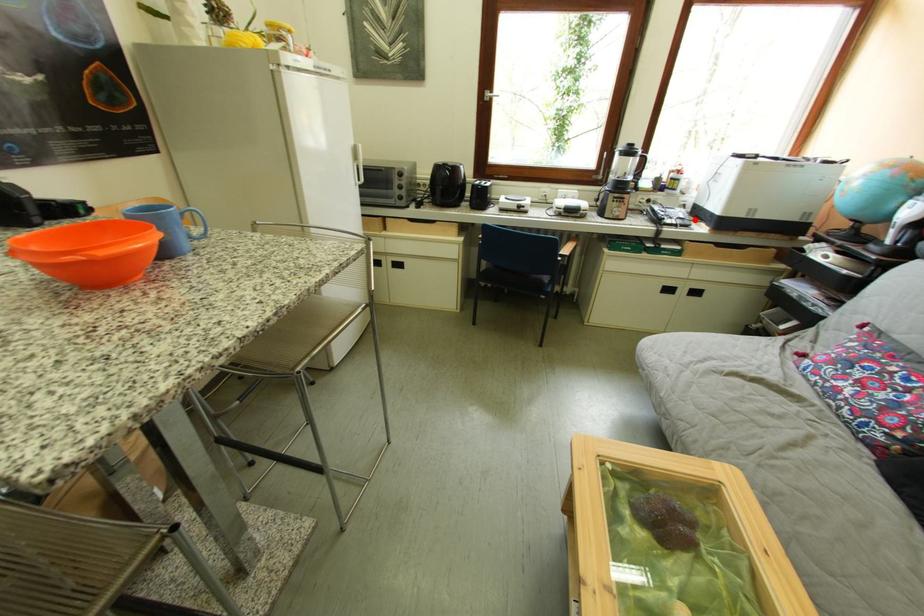
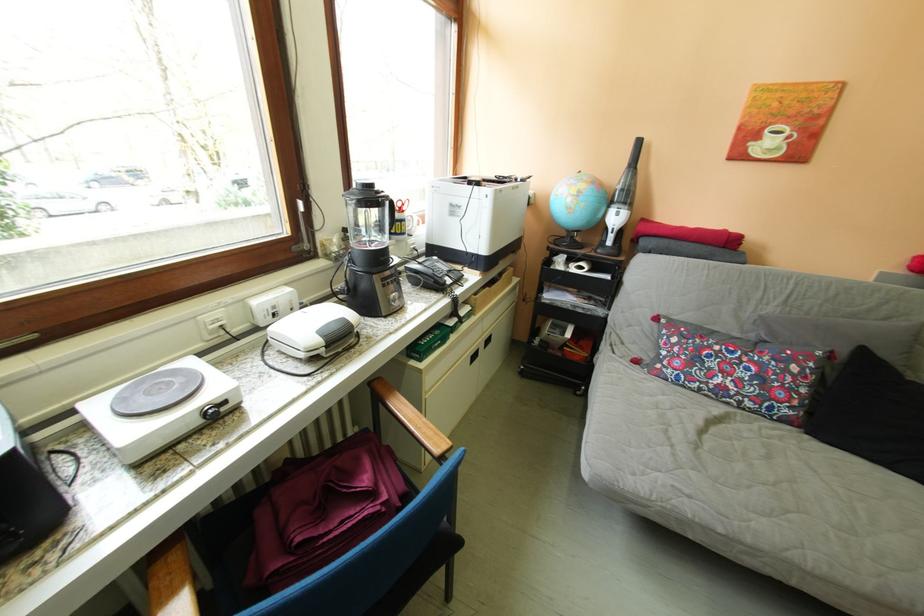
Where in the second image is the point corresponding to the highlighted location from the first image?

(460, 272)